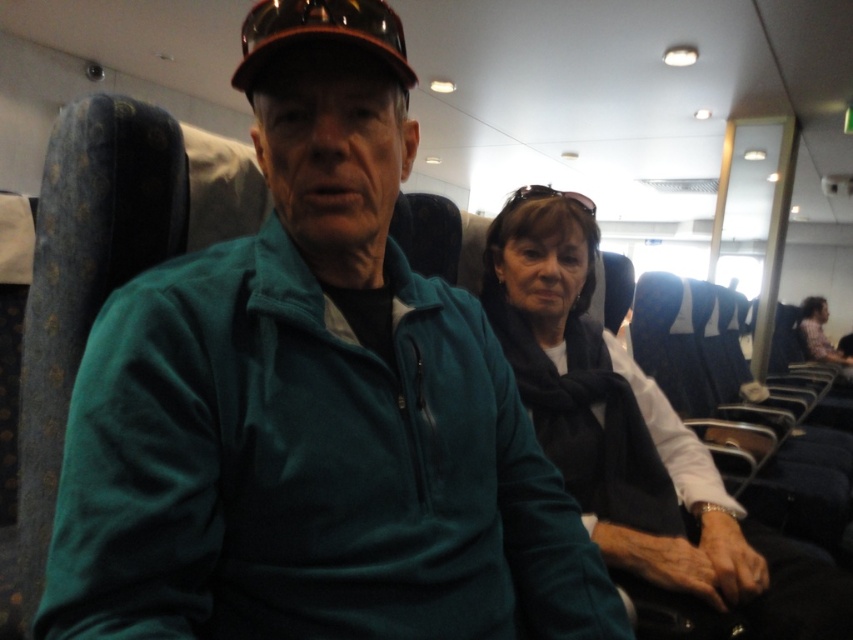
You are a flight attendant on an airplane. You need to deliver a blanket to a passenger seated near the black fabric scarf at center and another blanket to a passenger near the dark gray scarf at center. If your cart can carry blankets for up to 6 meters of travel, will you be able to distribute both blankets without returning to the cart?

The distance between the black fabric scarf at center and the dark gray scarf at center is 5.57 meters. Since the cart can travel up to 6 meters, you can deliver both blankets without needing to return to the cart.

You are an airline attendant checking the overhead compartments. You notice the teal fleece jacket at center and the black fabric scarf at center are both placed in the same compartment. Which item is shorter in length?

The teal fleece jacket at center is shorter than the black fabric scarf at center, so the teal fleece jacket at center is the shorter item.